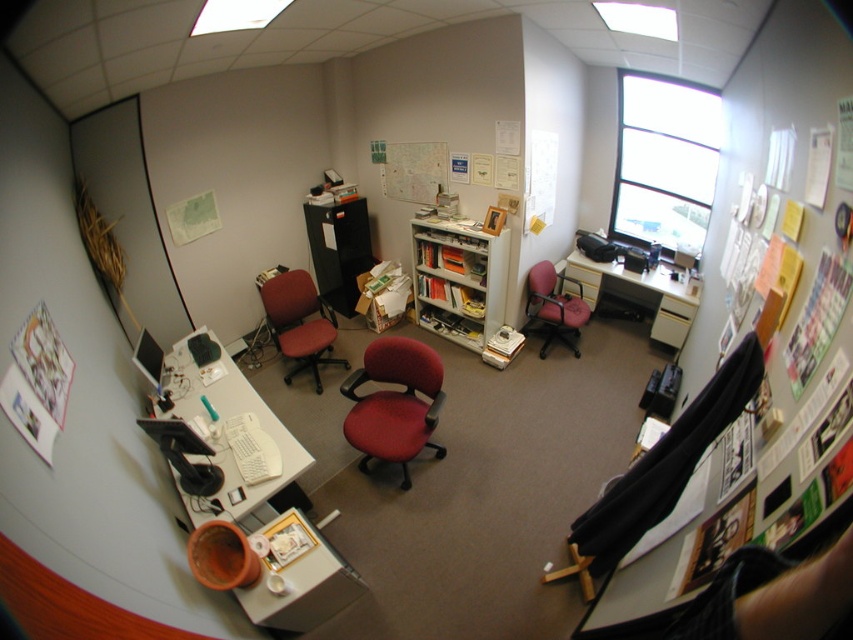
Who is lower down, white glossy computer desk at lower left or white glossy bookshelf at center?

white glossy computer desk at lower left is lower down.

Can you confirm if white glossy computer desk at lower left is positioned below white glossy bookshelf at center?

Correct, white glossy computer desk at lower left is located below white glossy bookshelf at center.

Locate an element on the screen. Image resolution: width=853 pixels, height=640 pixels. white glossy computer desk at lower left is located at coordinates (225, 429).

Does red fabric swivel chair at center lie in front of matte red office chair at center?

That is True.

Does red fabric swivel chair at center have a larger size compared to matte red office chair at center?

No.

Is point (378, 432) less distant than point (299, 294)?

Yes, point (378, 432) is in front of point (299, 294).

Image resolution: width=853 pixels, height=640 pixels. Find the location of `red fabric swivel chair at center`. red fabric swivel chair at center is located at coordinates (393, 403).

Is matte red office chair at center taller than pink fabric chair at center-right?

Yes, matte red office chair at center is taller than pink fabric chair at center-right.

Can you confirm if matte red office chair at center is positioned below pink fabric chair at center-right?

Yes.

What do you see at coordinates (299, 323) in the screenshot? I see `matte red office chair at center` at bounding box center [299, 323].

This screenshot has width=853, height=640. In order to click on matte red office chair at center in this screenshot , I will do `click(299, 323)`.